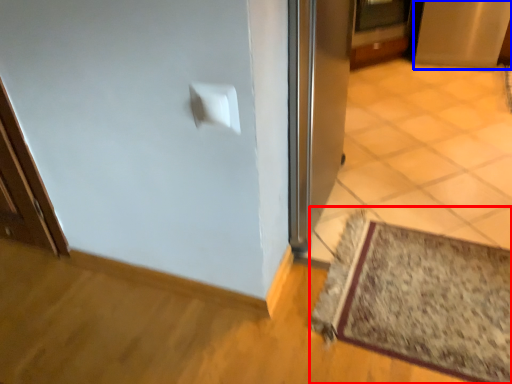
Question: Which point is closer to the camera, mat (highlighted by a red box) or screen door (highlighted by a blue box)?

Choices:
 (A) mat
 (B) screen door

Answer: (A)